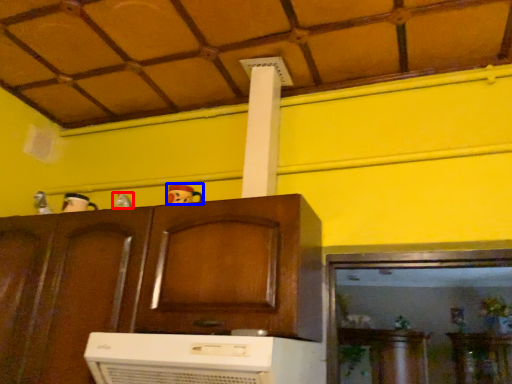
Question: Which point is closer to the camera, toy (highlighted by a red box) or toy (highlighted by a blue box)?

Choices:
 (A) toy
 (B) toy

Answer: (B)